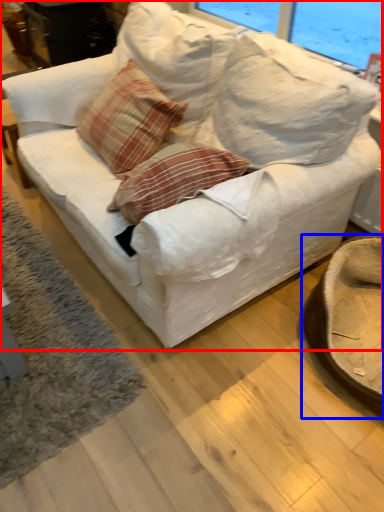
Question: Which object is further to the camera taking this photo, studio couch (highlighted by a red box) or swivel chair (highlighted by a blue box)?

Choices:
 (A) studio couch
 (B) swivel chair

Answer: (B)